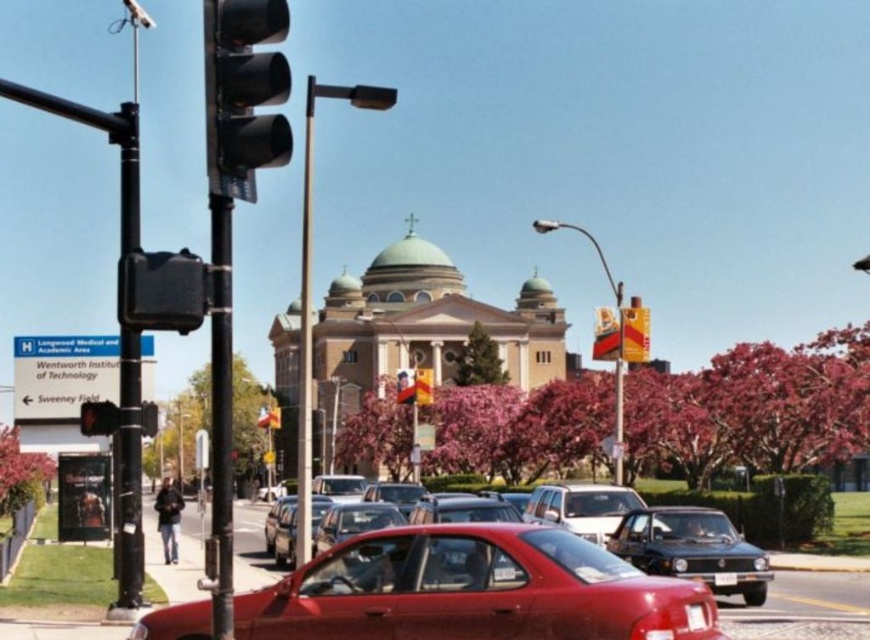
Based on the photo, you are driving a car that needs to stop at the traffic light. Your car is exactly 5 meters long. If the shiny black sedan at center is in front of you, how much distance is left between your car and the black plastic traffic light at left after you stop?

The shiny black sedan at center is 28.66 meters away from the black plastic traffic light at left. Since your car is 5 meters long, subtracting this length from the total distance gives 23.66 meters remaining between your car and the traffic light.

You are a pedestrian crossing the street and see the black matte traffic light at left and the shiny black sedan at center. Which object is bigger in size?

The black matte traffic light at left is larger in size than the shiny black sedan at center.